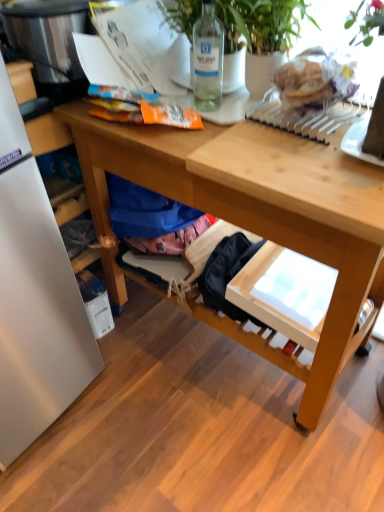
You are a GUI agent. You are given a task and a screenshot of the screen. Output one action in this format:
    pyautogui.click(x=<x>, y=<y>)
    Task: Click on the free space in front of green leafy plant at upper right
    
    Given the screenshot: What is the action you would take?
    pyautogui.click(x=231, y=140)